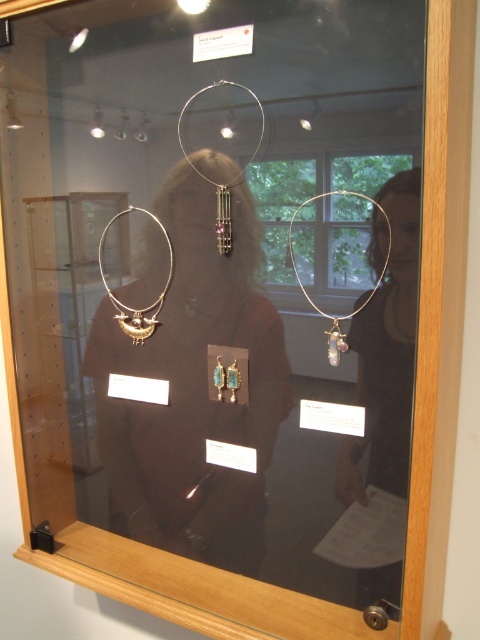
Which is behind, point (261, 108) or point (345, 348)?

Point (261, 108)

Can you confirm if silver/metallic hoop at center is thinner than gold metallic necklace at upper right?

In fact, silver/metallic hoop at center might be wider than gold metallic necklace at upper right.

Locate an element on the screen. silver/metallic hoop at center is located at coordinates (222, 180).

This screenshot has height=640, width=480. I want to click on silver/metallic hoop at center, so click(222, 180).

Can you confirm if gold metallic necklace at center is bigger than silver/metallic hoop at center?

Yes.

Is gold metallic necklace at center shorter than silver/metallic hoop at center?

Yes.

Which is behind, point (152, 323) or point (229, 220)?

The point (152, 323) is more distant.

The height and width of the screenshot is (640, 480). In order to click on gold metallic necklace at center in this screenshot , I will do `click(129, 305)`.

Which is above, matte gold necklace at center or gold metallic necklace at upper right?

gold metallic necklace at upper right is above.

Is matte gold necklace at center below gold metallic necklace at upper right?

Yes, matte gold necklace at center is below gold metallic necklace at upper right.

Is point (190, 253) farther from viewer compared to point (339, 316)?

Yes, it is behind point (339, 316).

This screenshot has height=640, width=480. In order to click on matte gold necklace at center in this screenshot , I will do `click(193, 388)`.